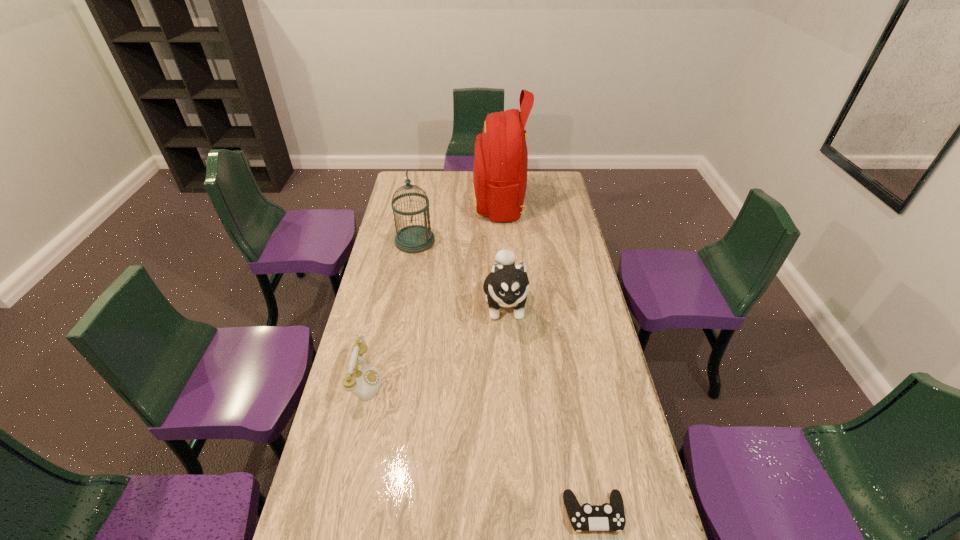
Choose which object is the fourth nearest neighbor to the puppy. Please provide its 2D coordinates. Your answer should be formatted as a tuple, i.e. [(x, y)], where the tuple contains the x and y coordinates of a point satisfying the conditions above.

[(610, 516)]

Where is `free location that satisfies the following two spatial constraints: 1. at the face of the puppy; 2. on the dial of the telephone`? This screenshot has width=960, height=540. free location that satisfies the following two spatial constraints: 1. at the face of the puppy; 2. on the dial of the telephone is located at coordinates (511, 381).